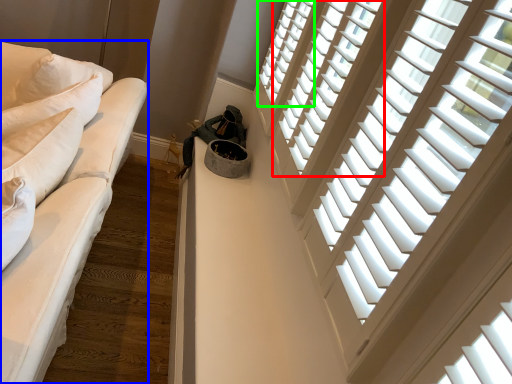
Question: Which is nearer to the window (highlighted by a red box)? studio couch (highlighted by a blue box) or window (highlighted by a green box).

Choices:
 (A) studio couch
 (B) window

Answer: (B)